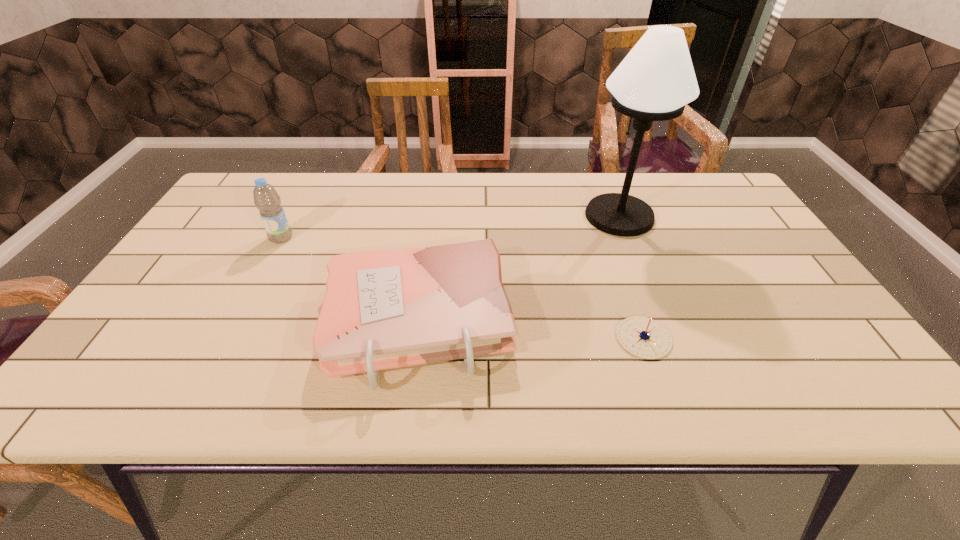
You are a GUI agent. You are given a task and a screenshot of the screen. Output one action in this format:
    pyautogui.click(x=<x>, y=<y>)
    Task: Click on the free spot between the tallest object and the phonebook
    This screenshot has width=960, height=540.
    Given the screenshot: What is the action you would take?
    pyautogui.click(x=518, y=269)

Where is `free space between the tallest object and the compass`? The image size is (960, 540). free space between the tallest object and the compass is located at coordinates (632, 277).

Image resolution: width=960 pixels, height=540 pixels. I want to click on the closest object to the second tallest object, so point(384,309).

At what (x,y) coordinates should I click in order to perform the action: click on the third closest object to the third shortest object. Please return your answer as a coordinate pair (x, y). Looking at the image, I should click on (643, 337).

Image resolution: width=960 pixels, height=540 pixels. I want to click on free space that satisfies the following two spatial constraints: 1. on the front side of the phonebook; 2. on the right side of the shortest object, so click(416, 338).